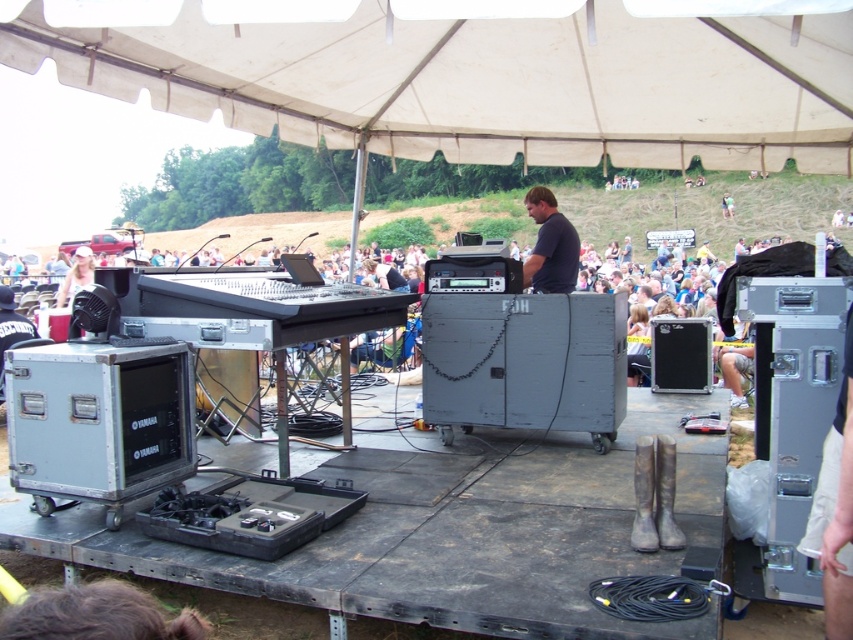
You are a technician at the event. You need to place a new microphone stand between the white fabric canopy at upper center and the matte white baseball cap at upper left. Based on their positions, will the microphone stand be under the canopy or the cap?

The white fabric canopy at upper center is positioned over the matte white baseball cap at upper left. Therefore, placing the microphone stand between them would mean it is under the canopy but not under the cap.

You are a stagehand at the event and need to locate the dark gray shirt at center and the matte white baseball cap at upper left. Which object is closer to the ground?

The dark gray shirt at center is shorter than the matte white baseball cap at upper left, so the dark gray shirt at center is closer to the ground.